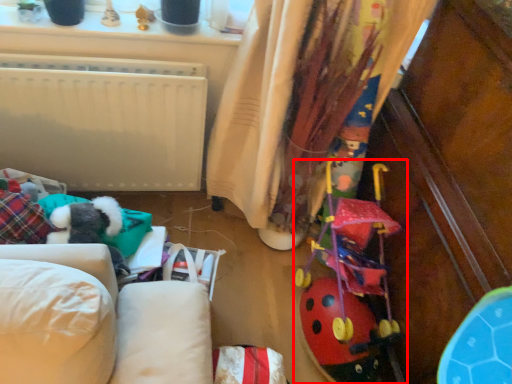
Question: Observing the image, what is the correct spatial positioning of toy (annotated by the red box) in reference to curtain?

Choices:
 (A) left
 (B) right

Answer: (B)